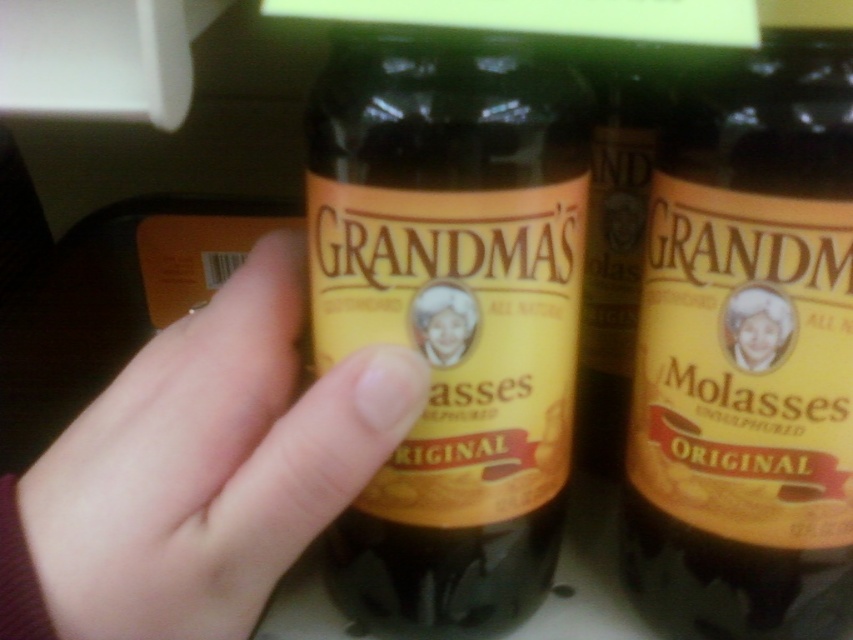
Is matte glass jar at center smaller than matte glass bottle at center?

No.

Is matte glass jar at center thinner than matte glass bottle at center?

No, matte glass jar at center is not thinner than matte glass bottle at center.

Does point (421, 180) come farther from viewer compared to point (764, 452)?

No, it is not.

Where is `matte glass jar at center`? The width and height of the screenshot is (853, 640). matte glass jar at center is located at coordinates (451, 316).

Who is lower down, smooth skin at center or matte yellow label at center?

smooth skin at center is lower down.

Measure the distance between point (364, 458) and camera.

Point (364, 458) is 10.97 inches from camera.

Is point (259, 458) positioned behind point (790, 321)?

No.

Locate an element on the screen. smooth skin at center is located at coordinates (209, 465).

Between point (682, 605) and point (204, 497), which one is positioned behind?

Point (682, 605)

Is point (646, 371) positioned before point (55, 560)?

That is False.

Identify the location of matte glass bottle at center. This screenshot has height=640, width=853. (730, 358).

Identify the location of matte glass bottle at center. Image resolution: width=853 pixels, height=640 pixels. (730, 358).